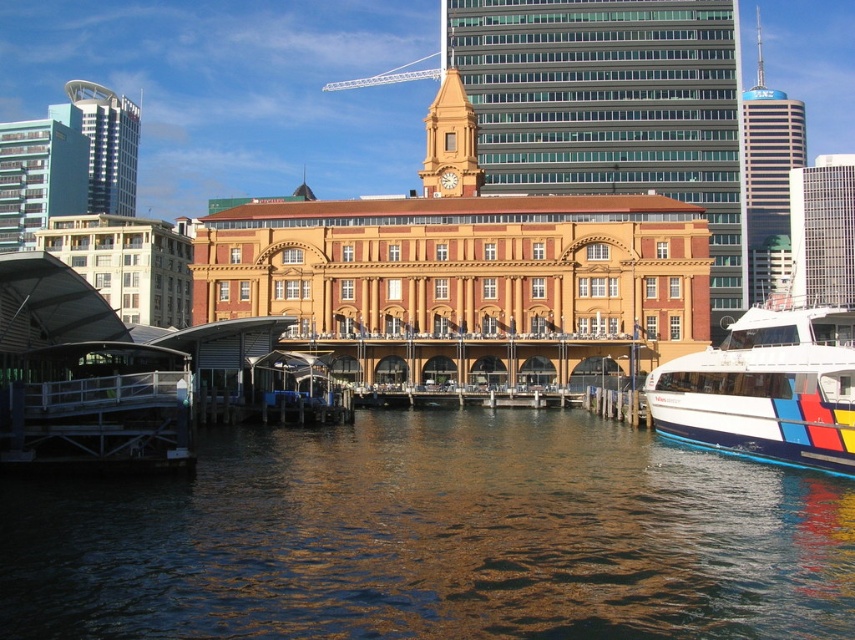
Question: Which point appears closest to the camera in this image?

Choices:
 (A) (629, 609)
 (B) (823, 412)

Answer: (A)

Question: Which of the following is the closest to the observer?

Choices:
 (A) brown reflective water at center
 (B) white glossy boat at lower right

Answer: (A)

Question: Is brown reflective water at center in front of white glossy boat at lower right?

Choices:
 (A) no
 (B) yes

Answer: (B)

Question: Can you confirm if brown reflective water at center is bigger than white glossy boat at lower right?

Choices:
 (A) no
 (B) yes

Answer: (B)

Question: Observing the image, what is the correct spatial positioning of brown reflective water at center in reference to white glossy boat at lower right?

Choices:
 (A) above
 (B) below

Answer: (B)